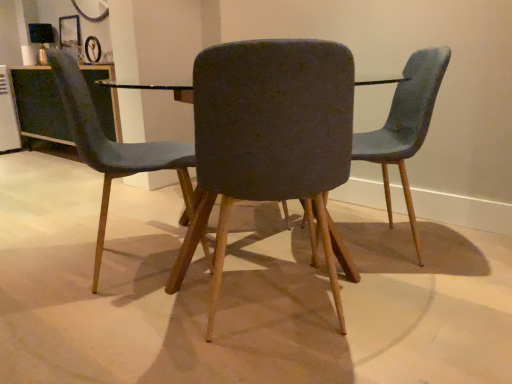
Locate an element on the screen. This screenshot has width=512, height=384. vacant space that is in between matte black table at center and textured gray chair at center, which appears as the second chair when viewed from the left is located at coordinates (267, 306).